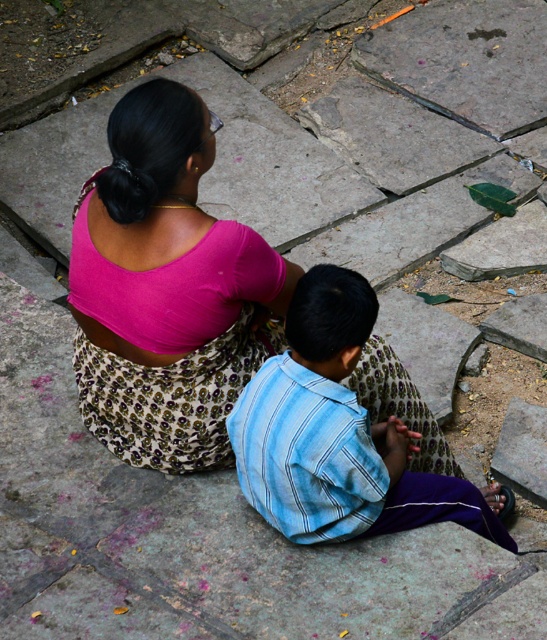
You are a photographer trying to capture a photo of the pink fabric at center and the blue striped shirt at center from the current camera position. Which object will appear larger in the photo?

The pink fabric at center will appear larger in the photo because it is taller than the blue striped shirt at center.

You are standing at the camera position and want to hand a small gift to the person wearing the pink fabric at center. The gift requires you to be within 2 meters to hand it properly. Can you reach them without moving closer?

The distance between the pink fabric at center and the camera is 2.50 meters, which is beyond the 2 meters required. Therefore, you cannot reach them without moving closer.